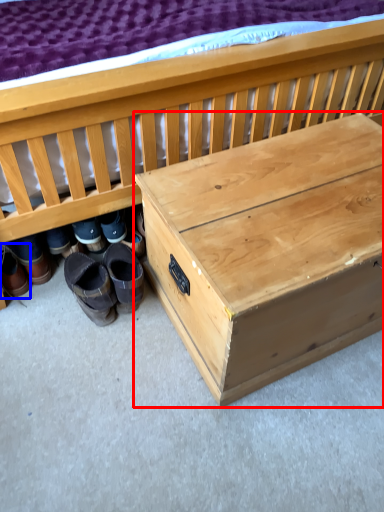
Question: Which object is further to the camera taking this photo, table (highlighted by a red box) or footwear (highlighted by a blue box)?

Choices:
 (A) table
 (B) footwear

Answer: (B)